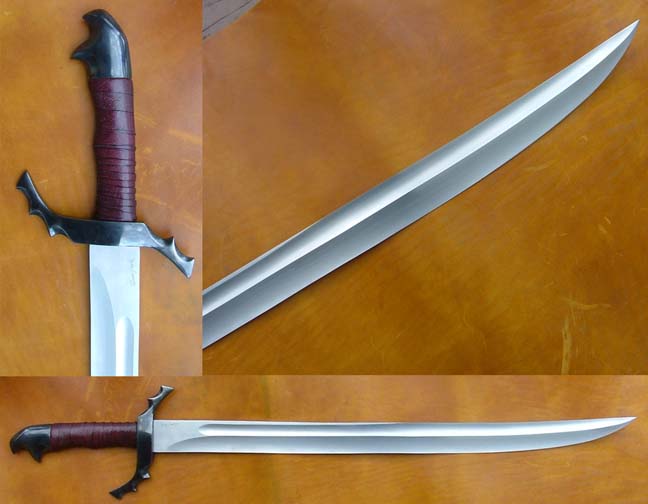
The width and height of the screenshot is (648, 504). I want to click on handle, so click(x=111, y=116).